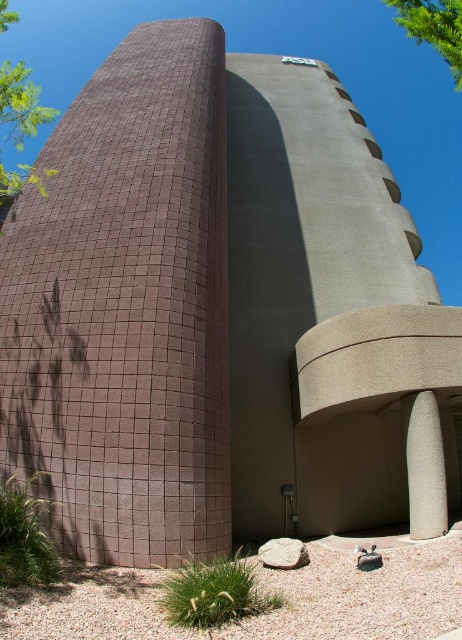
Question: Can you confirm if green leafy tree at upper left is positioned above green leafy tree at upper right?

Choices:
 (A) no
 (B) yes

Answer: (A)

Question: Does green leafy tree at upper left appear on the left side of green leafy tree at upper right?

Choices:
 (A) no
 (B) yes

Answer: (B)

Question: Which point is closer to the camera taking this photo?

Choices:
 (A) (18, 168)
 (B) (401, 3)

Answer: (B)

Question: Is green leafy tree at upper left smaller than green leafy tree at upper right?

Choices:
 (A) no
 (B) yes

Answer: (B)

Question: Which point is closer to the camera taking this photo?

Choices:
 (A) (399, 3)
 (B) (20, 122)

Answer: (A)

Question: Which object appears farthest from the camera in this image?

Choices:
 (A) green leafy tree at upper right
 (B) green leafy tree at upper left

Answer: (B)